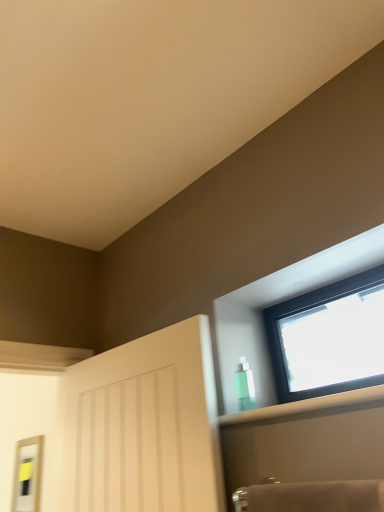
Question: From the image's perspective, relative to green translucent bottle at upper right, is matte silver mirror at left above or below?

Choices:
 (A) below
 (B) above

Answer: (A)

Question: In terms of width, does matte silver mirror at left look wider or thinner when compared to green translucent bottle at upper right?

Choices:
 (A) wide
 (B) thin

Answer: (B)

Question: Estimate the real-world distances between objects in this image. Which object is closer to the transparent plastic bottle at upper right?

Choices:
 (A) matte silver mirror at left
 (B) green translucent bottle at upper right
 (C) transparent glass window at upper right

Answer: (B)

Question: Which object is the farthest from the transparent glass window at upper right?

Choices:
 (A) transparent plastic bottle at upper right
 (B) green translucent bottle at upper right
 (C) matte silver mirror at left

Answer: (C)